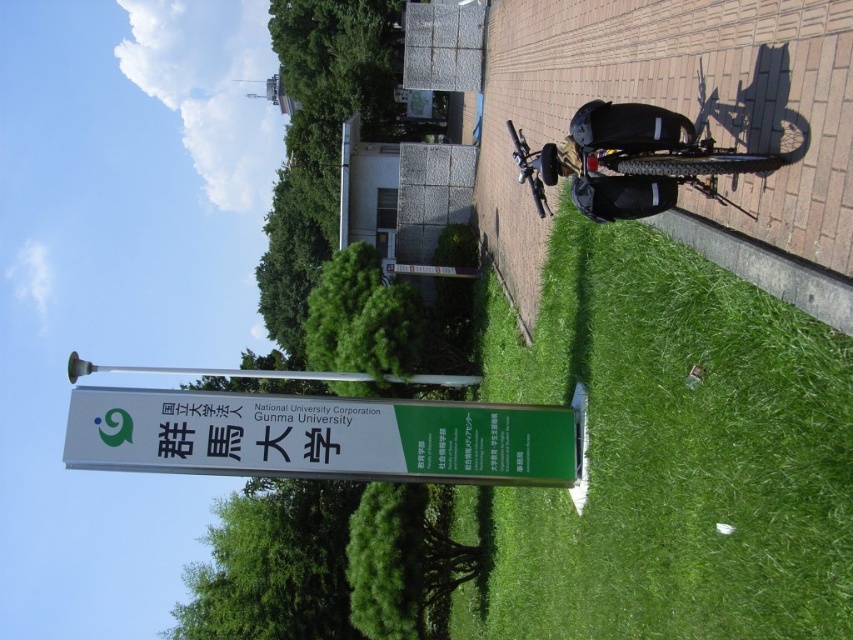
Does green grass at lower center appear under silver metallic pole at upper center?

Yes, green grass at lower center is below silver metallic pole at upper center.

Where is `green grass at lower center`? Image resolution: width=853 pixels, height=640 pixels. green grass at lower center is located at coordinates (666, 456).

Is green plastic sign at center below silver metallic pole at upper center?

No, green plastic sign at center is not below silver metallic pole at upper center.

Which is more to the left, green plastic sign at center or silver metallic pole at upper center?

silver metallic pole at upper center is more to the left.

Describe the element at coordinates (320, 436) in the screenshot. I see `green plastic sign at center` at that location.

Image resolution: width=853 pixels, height=640 pixels. Identify the location of green plastic sign at center. (320, 436).

Between green grass at lower center and green plastic sign at center, which one appears on the right side from the viewer's perspective?

Positioned to the right is green grass at lower center.

Between point (585, 228) and point (558, 451), which one is positioned behind?

The point (558, 451) is more distant.

Is point (657, 605) closer to viewer compared to point (335, 408)?

That is True.

Locate an element on the screen. The height and width of the screenshot is (640, 853). green grass at lower center is located at coordinates (666, 456).